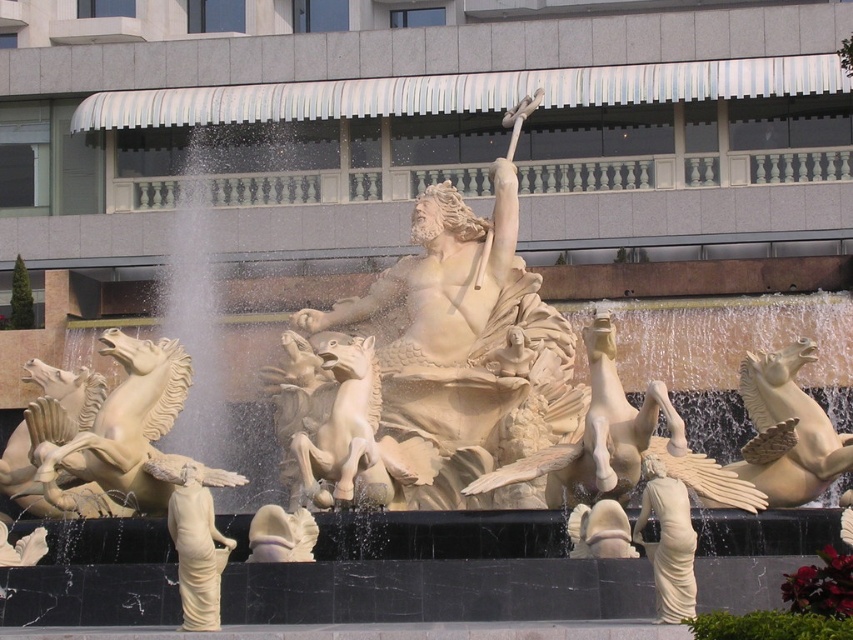
Can you confirm if white marble statue at center is positioned to the left of beige stone horse at left?

No, white marble statue at center is not to the left of beige stone horse at left.

Does white marble statue at center have a lesser height compared to beige stone horse at left?

In fact, white marble statue at center may be taller than beige stone horse at left.

Does point (380, 275) come in front of point (59, 419)?

No.

Locate an element on the screen. white marble statue at center is located at coordinates (462, 349).

Who is lower down, white marble statue at center or matte beige statue at lower center?

matte beige statue at lower center is below.

Can you confirm if white marble statue at center is positioned to the left of matte beige statue at lower center?

No, white marble statue at center is not to the left of matte beige statue at lower center.

The image size is (853, 640). What do you see at coordinates (462, 349) in the screenshot? I see `white marble statue at center` at bounding box center [462, 349].

This screenshot has height=640, width=853. Find the location of `white marble statue at center`. white marble statue at center is located at coordinates (462, 349).

Can you confirm if beige stone horse at left is wider than matte beige statue at lower center?

Indeed, beige stone horse at left has a greater width compared to matte beige statue at lower center.

Is beige stone horse at left below matte beige statue at lower center?

No.

What do you see at coordinates (111, 433) in the screenshot? I see `beige stone horse at left` at bounding box center [111, 433].

Identify the location of beige stone horse at left. (111, 433).